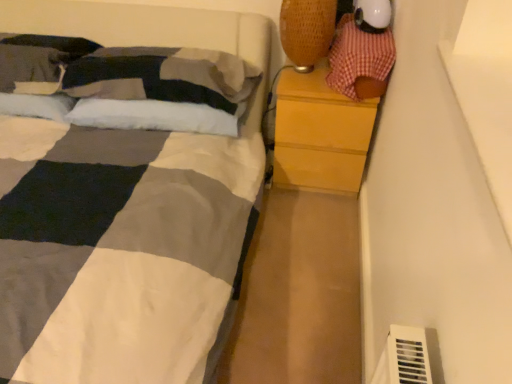
Question: Is wooden chest of drawers at right smaller than white soft pillow at upper left, the 2th pillow in the left-to-right sequence?

Choices:
 (A) no
 (B) yes

Answer: (A)

Question: From the image's perspective, is wooden chest of drawers at right located above white soft pillow at upper left, the 2th pillow in the left-to-right sequence?

Choices:
 (A) yes
 (B) no

Answer: (B)

Question: Is wooden chest of drawers at right positioned beyond the bounds of white soft pillow at upper left, the 2th pillow in the left-to-right sequence?

Choices:
 (A) no
 (B) yes

Answer: (B)

Question: From a real-world perspective, is wooden chest of drawers at right positioned under white soft pillow at upper left, placed as the 1th pillow when sorted from right to left, based on gravity?

Choices:
 (A) yes
 (B) no

Answer: (A)

Question: Is wooden chest of drawers at right at the left side of white soft pillow at upper left, placed as the 1th pillow when sorted from right to left?

Choices:
 (A) yes
 (B) no

Answer: (B)

Question: From the image's perspective, relative to white soft pillow at upper left, the 2th pillow in the left-to-right sequence, is soft cotton pillow at upper left, arranged as the 2th pillow when viewed from the right, above or below?

Choices:
 (A) above
 (B) below

Answer: (A)

Question: From a real-world perspective, is soft cotton pillow at upper left, positioned as the 1th pillow in left-to-right order, physically located above or below white soft pillow at upper left, placed as the 1th pillow when sorted from right to left?

Choices:
 (A) above
 (B) below

Answer: (A)

Question: Relative to white soft pillow at upper left, placed as the 1th pillow when sorted from right to left, is soft cotton pillow at upper left, arranged as the 2th pillow when viewed from the right, in front or behind?

Choices:
 (A) behind
 (B) front

Answer: (A)

Question: In terms of height, does soft cotton pillow at upper left, positioned as the 1th pillow in left-to-right order, look taller or shorter compared to white soft pillow at upper left, placed as the 1th pillow when sorted from right to left?

Choices:
 (A) tall
 (B) short

Answer: (A)

Question: Is point (311, 51) positioned closer to the camera than point (23, 39)?

Choices:
 (A) closer
 (B) farther

Answer: (A)

Question: Which is correct: woven fabric table lamp at upper right is inside soft cotton pillow at upper left, positioned as the 1th pillow in left-to-right order, or outside of it?

Choices:
 (A) inside
 (B) outside

Answer: (B)

Question: From a real-world perspective, is woven fabric table lamp at upper right physically located above or below soft cotton pillow at upper left, arranged as the 2th pillow when viewed from the right?

Choices:
 (A) below
 (B) above

Answer: (B)

Question: In terms of height, does woven fabric table lamp at upper right look taller or shorter compared to soft cotton pillow at upper left, positioned as the 1th pillow in left-to-right order?

Choices:
 (A) tall
 (B) short

Answer: (A)

Question: Do you think checkered fabric toy at upper right is within white soft pillow at upper left, the 2th pillow in the left-to-right sequence, or outside of it?

Choices:
 (A) outside
 (B) inside

Answer: (A)

Question: In the image, is checkered fabric toy at upper right positioned in front of or behind white soft pillow at upper left, placed as the 1th pillow when sorted from right to left?

Choices:
 (A) behind
 (B) front

Answer: (B)